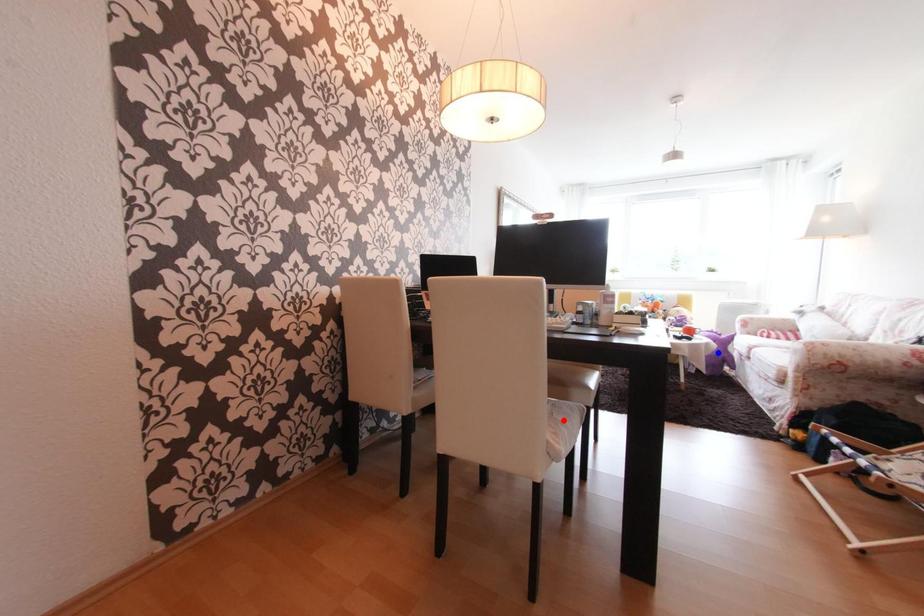
Question: In the image, two points are highlighted. Which point is nearer to the camera? Reply with the corresponding letter.

Choices:
 (A) blue point
 (B) red point

Answer: (B)